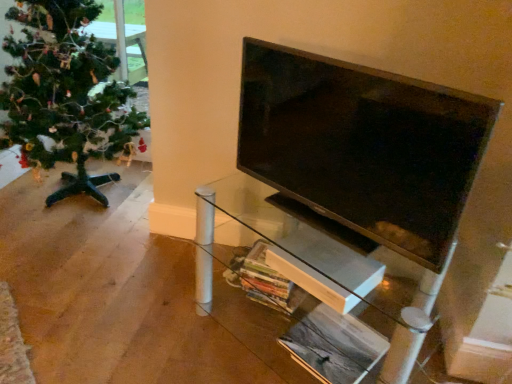
This screenshot has height=384, width=512. Find the location of `blank space to the left of transparent glass tv stand at center`. blank space to the left of transparent glass tv stand at center is located at coordinates (152, 320).